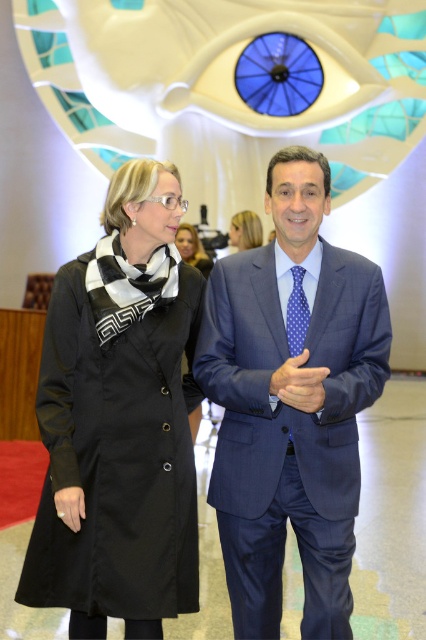
You are a photographer setting up for a group photo at this event. You need to position two markers at the coordinates point (190, 241) and point (71, 531). Which marker will appear closer to the camera in the final photo?

Point (190, 241) is further to the camera than point (71, 531), so the marker at point (190, 241) will appear closer to the camera in the final photo.

You are a photographer standing at the entrance of the event venue. You want to take a photo of the black matte coat at center from a distance where it will appear sharp without needing a tripod. Considering the recommended minimum distance for sharp photos without a tripod is 5 meters, can you take the photo from your current position?

The black matte coat at center and viewer are 7.93 meters apart. Since the recommended minimum distance is 5 meters, you can take the photo from your current position as you are farther away than the required distance.

From the picture: You are a photographer setting up for a group photo. You need to ensure that the black matte coat at center and the blonde hair at upper center are both visible in the frame. Based on their sizes, which object might require more space in the composition?

The black matte coat at center might require more space in the composition because it is wider than the blonde hair at upper center.